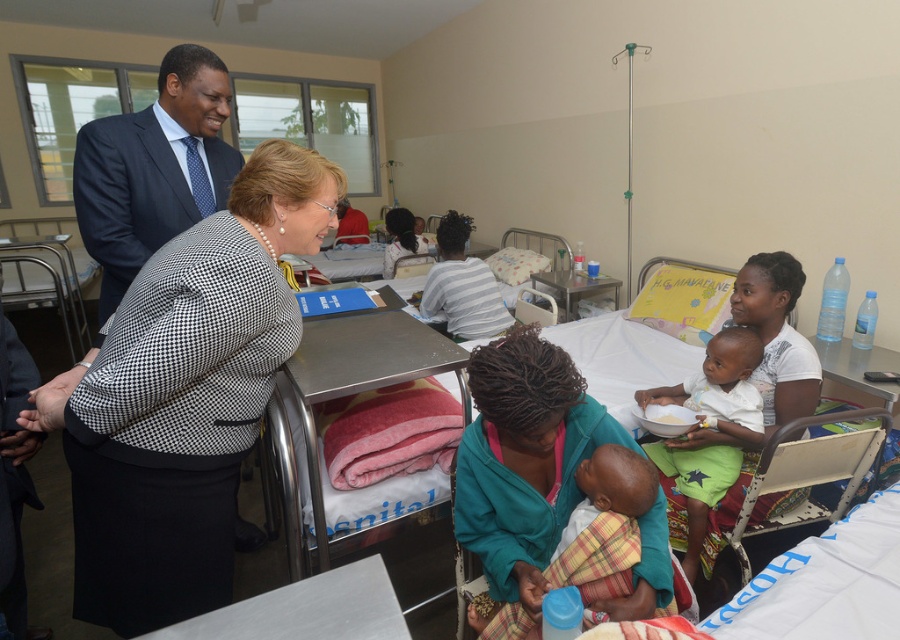
Question: Does dark blue suit at upper left appear over green cotton shorts at lower right?

Choices:
 (A) no
 (B) yes

Answer: (B)

Question: Which point is closer to the camera taking this photo?

Choices:
 (A) [x=115, y=321]
 (B) [x=608, y=593]

Answer: (B)

Question: Is dark blue suit at upper left above green cotton shorts at lower right?

Choices:
 (A) no
 (B) yes

Answer: (B)

Question: Estimate the real-world distances between objects in this image. Which object is farther from the green cotton shorts at lower right?

Choices:
 (A) plaid fabric baby at center
 (B) dark blue suit at upper left

Answer: (B)

Question: Which object is the farthest from the plaid fabric baby at center?

Choices:
 (A) green cotton shorts at lower right
 (B) black houndstooth blazer at center
 (C) dark blue suit at upper left

Answer: (C)

Question: Observing the image, what is the correct spatial positioning of plaid fabric baby at center in reference to green cotton shorts at lower right?

Choices:
 (A) left
 (B) right

Answer: (A)